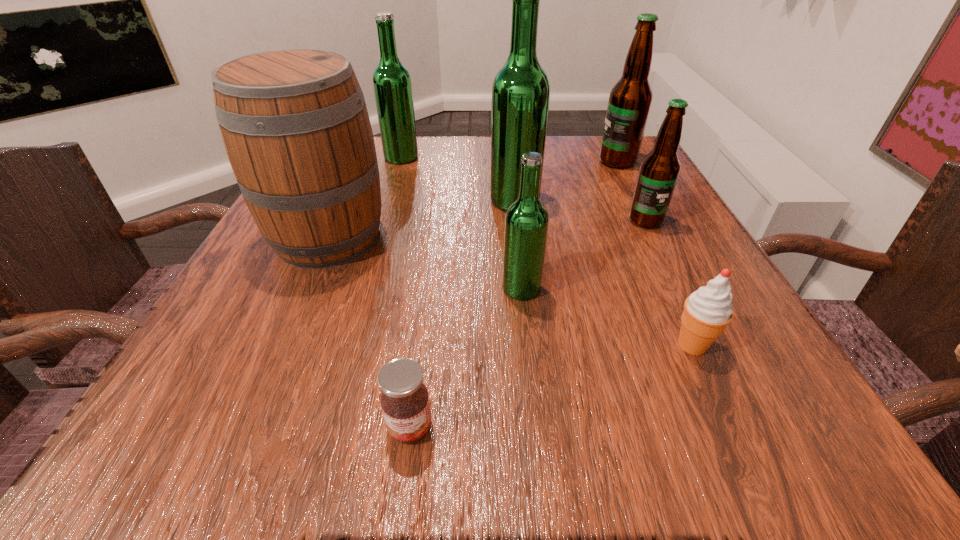
Find the location of a particular element. The width and height of the screenshot is (960, 540). the third closest beer bottle to the biggest green beer bottle is located at coordinates [526, 223].

Locate an element on the screen. The image size is (960, 540). the second closest green beer bottle relative to the smaller brown beer bottle is located at coordinates (526, 223).

Locate which green beer bottle ranks second in proximity to the biggest green beer bottle. Please provide its 2D coordinates. Your answer should be formatted as a tuple, i.e. [(x, y)], where the tuple contains the x and y coordinates of a point satisfying the conditions above.

[(392, 84)]

What are the coordinates of `vacant space that satisfies the following two spatial constraints: 1. on the label of the bigger brown beer bottle; 2. on the label of the nearer brown beer bottle` in the screenshot? It's located at (647, 220).

At what (x,y) coordinates should I click in order to perform the action: click on free space that satisfies the following two spatial constraints: 1. on the front side of the second shortest object; 2. on the left side of the cider. Please return your answer as a coordinate pair (x, y). Looking at the image, I should click on (280, 345).